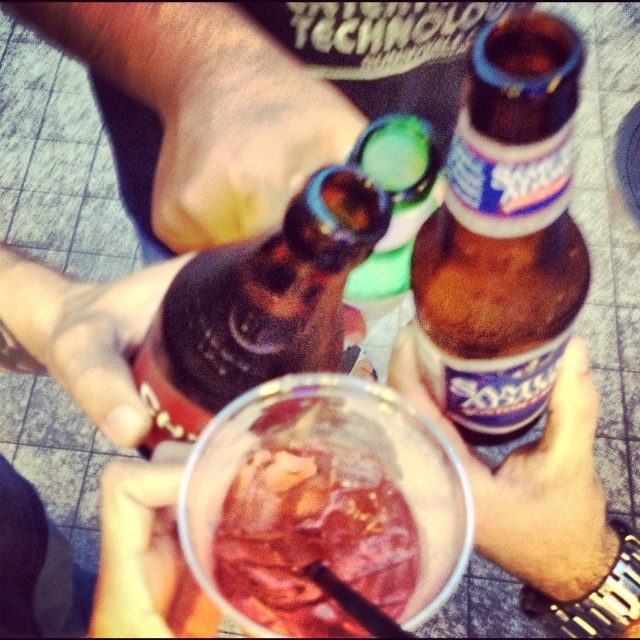
You are at a party and want to grab the translucent glass drink at center without touching the matte black hand at center. Is the drink narrow enough to fit between your fingers without hitting the hand?

The translucent glass drink at center is thinner than the matte black hand at center, so yes, it can be grabbed without touching the hand as its width is narrower than the hand.

You are a bartender trying to clean up after a party. You see the translucent glass drink at center and the translucent plastic cup at lower center. Which one is closer to you?

The translucent glass drink at center is closer to you because the translucent plastic cup at lower center is behind it.

You are at a party and want to pour the contents of the translucent glass drink at center into the translucent plastic cup at lower center. Will the cup hold all the liquid without spilling?

The translucent glass drink at center is larger in size than the translucent plastic cup at lower center, so pouring its contents into the cup may cause overflow and potential spillage.